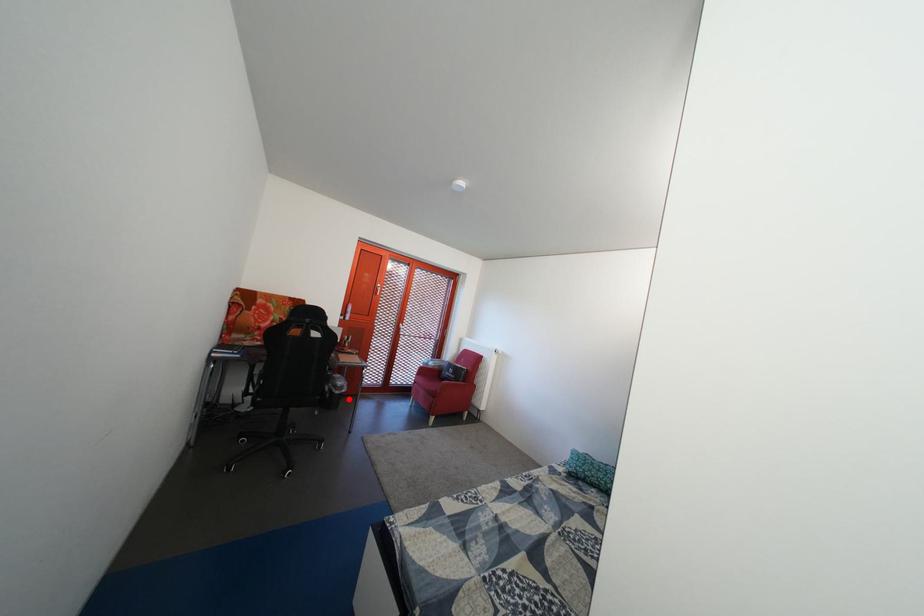
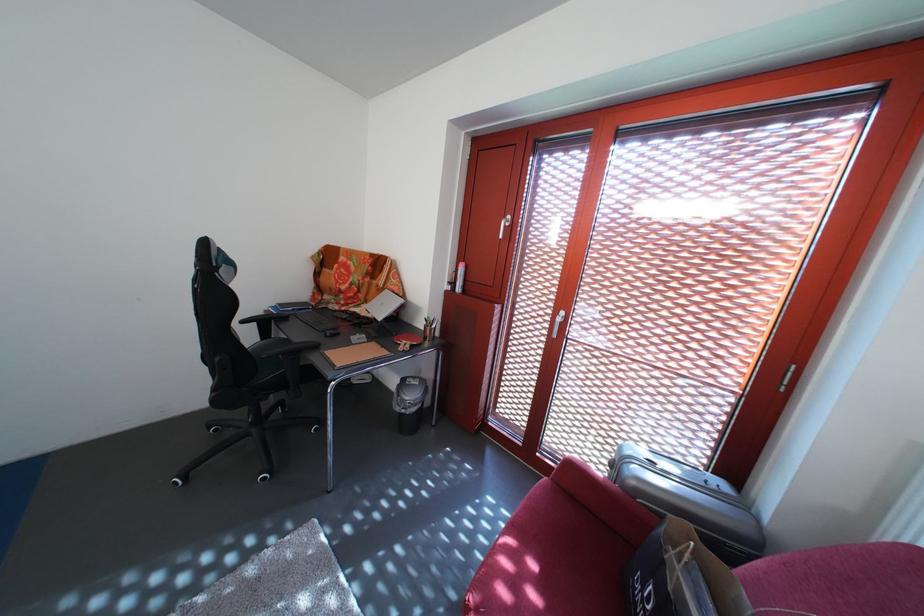
Question: I am providing you with two images of the same scene from different viewpoints. Given a red point in image1, look at the same physical point in image2. Is it:

Choices:
 (A) Closer to the viewpoint
 (B) Farther from the viewpoint

Answer: (B)